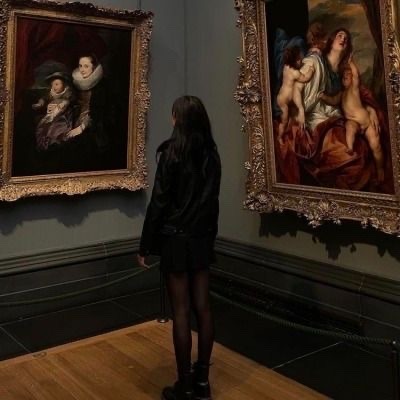
At what (x,y) coordinates should I click in order to perform the action: click on grey walls. Please return your answer as a coordinate pair (x, y). Looking at the image, I should click on (58, 239), (221, 231).